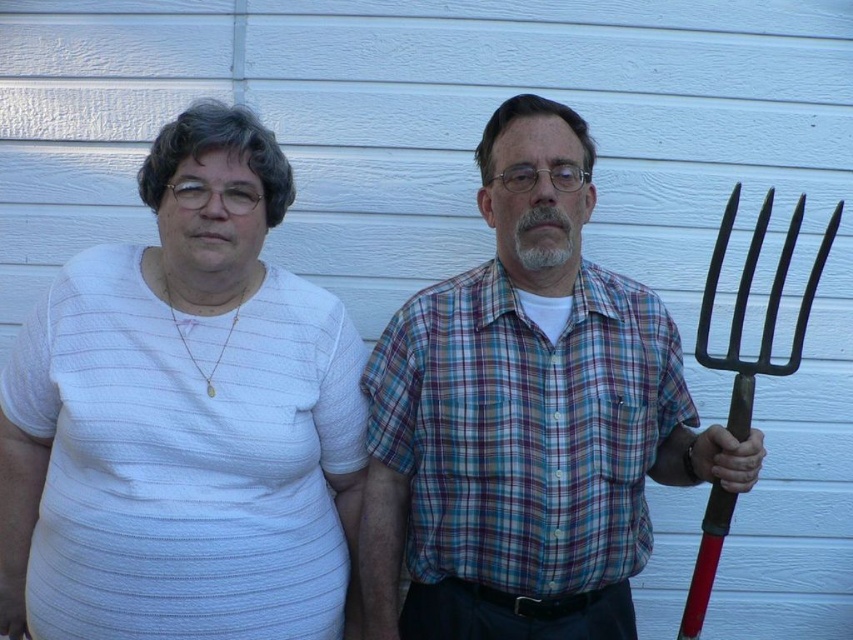
Question: Which is nearer to the white striped shirt at left?

Choices:
 (A) red metal pitchfork at right
 (B) matte plaid shirt at center

Answer: (B)

Question: Which point is farther to the camera?

Choices:
 (A) matte plaid shirt at center
 (B) red metal pitchfork at right
 (C) white striped shirt at left

Answer: (C)

Question: Does white striped shirt at left appear on the right side of matte plaid shirt at center?

Choices:
 (A) no
 (B) yes

Answer: (A)

Question: Observing the image, what is the correct spatial positioning of matte plaid shirt at center in reference to red metal pitchfork at right?

Choices:
 (A) above
 (B) below

Answer: (A)

Question: Which object is positioned closest to the matte plaid shirt at center?

Choices:
 (A) red metal pitchfork at right
 (B) white striped shirt at left

Answer: (A)

Question: Can you confirm if white striped shirt at left is positioned above red metal pitchfork at right?

Choices:
 (A) yes
 (B) no

Answer: (A)